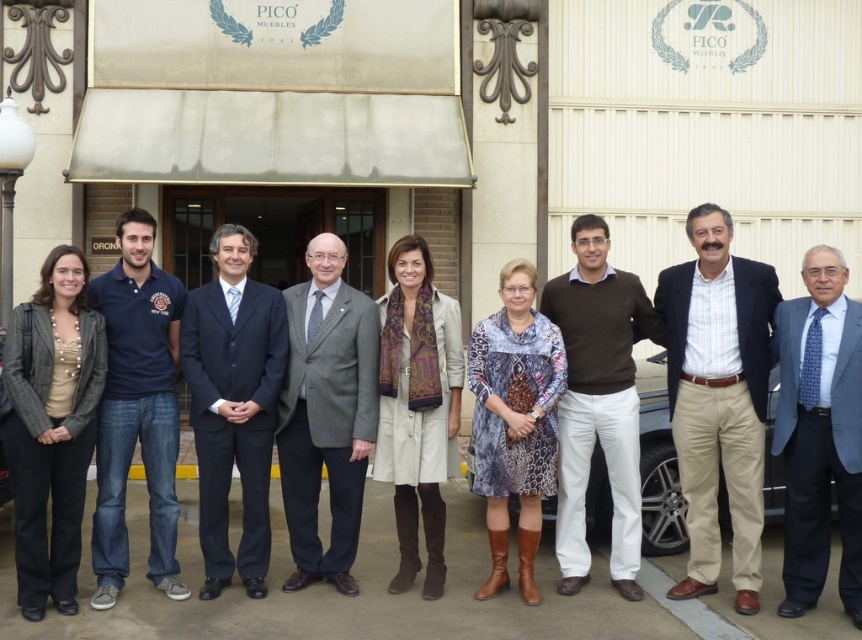
Question: Which object is farther from the camera taking this photo?

Choices:
 (A) gray wool suit at center
 (B) blue dotted tie at center
 (C) brown sweater at center

Answer: (A)

Question: Can you confirm if brown cotton pants at center is positioned below dark gray textured jacket at left?

Choices:
 (A) no
 (B) yes

Answer: (A)

Question: Is gray wool suit at center bigger than brown sweater at center?

Choices:
 (A) no
 (B) yes

Answer: (A)

Question: Does blue dotted tie at center lie in front of brown sweater at center?

Choices:
 (A) yes
 (B) no

Answer: (A)

Question: Which object is closer to the camera taking this photo?

Choices:
 (A) dark blue suit at center
 (B) brown sweater at center
 (C) dark gray textured jacket at left

Answer: (C)

Question: Based on their relative distances, which object is farther from the brown cotton pants at center?

Choices:
 (A) blue cotton polo shirt at left
 (B) dark blue suit at center
 (C) dark gray textured jacket at left
 (D) brown sweater at center

Answer: (C)